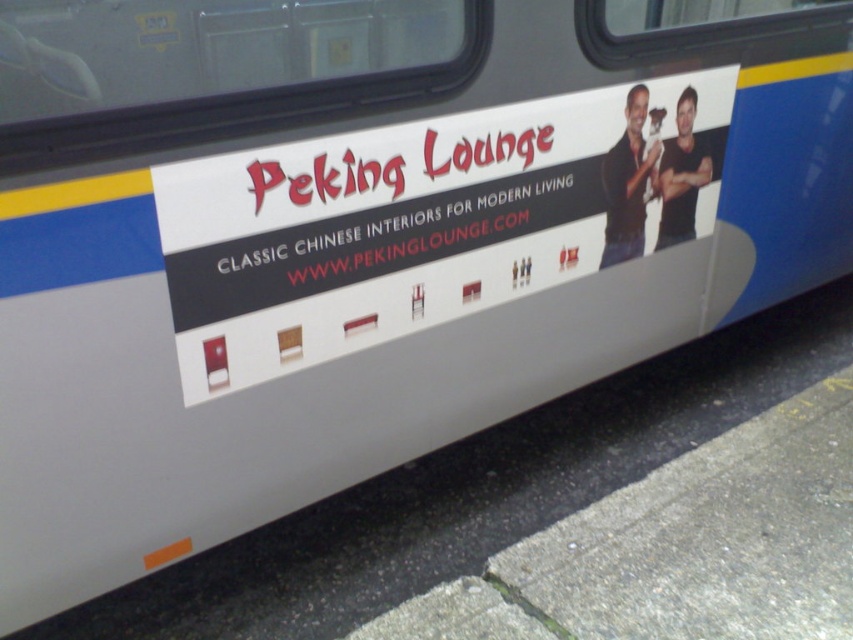
You are a delivery person who needs to attach a sticker exactly at the center of the white matte signboard at center. According to the image, where should you place the sticker?

The sticker should be placed at point [433,224] on the white matte signboard at center as specified in the coordinates.

You are a passenger on the vehicle and want to read the white matte text at center. Can you read it easily if you are standing directly in front of the white matte signboard at center?

The white matte signboard at center is much taller than the white matte text at center. Since the signboard is taller, it might block part of the text, making it harder to read. However, the exact visibility depends on their positions and angles, but based on size alone, the text could be partially obscured.

You are a photographer standing 1.2 meters tall. You want to take a photo of the white matte signboard at center from a position where your eyes are level with the bottom edge of the signboard. Given that the distance from the camera to the signboard is 1.50 meters as stated, can you estimate how far you need to step back from your current position to achieve this?

The white matte signboard at center is 1.50 meters away from the camera. To have your eyes level with the bottom edge, you need to position yourself so that the distance matches the height of your eyes. Since you are 1.2 meters tall, stepping back until the camera is 1.2 meters away from the signboard would align your eye level. However, the current distance is 1.50 meters, which is farther than needed. Therefore, you should move 0.30 meters closer, not step back. Wait, this might be incorrect. Let me rec